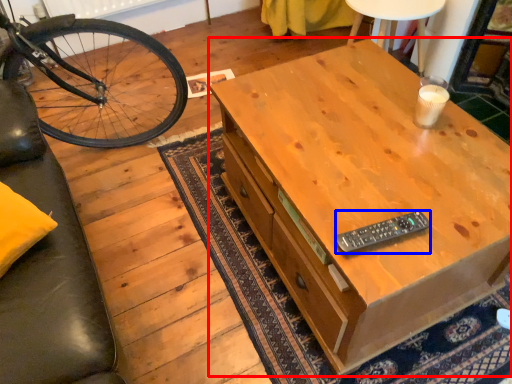
Question: Which object is closer to the camera taking this photo, desk (highlighted by a red box) or remote control (highlighted by a blue box)?

Choices:
 (A) desk
 (B) remote control

Answer: (A)